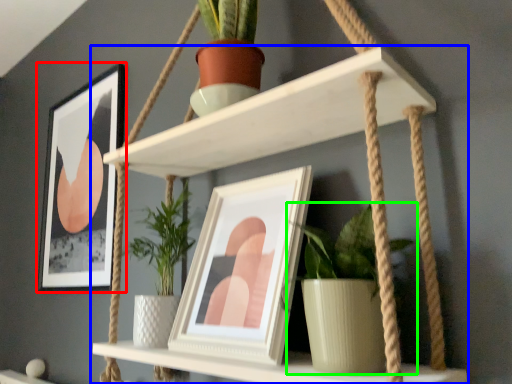
Question: Based on their relative distances, which object is nearer to picture frame (highlighted by a red box)? Choose from shelf (highlighted by a blue box) and houseplant (highlighted by a green box).

Choices:
 (A) shelf
 (B) houseplant

Answer: (A)